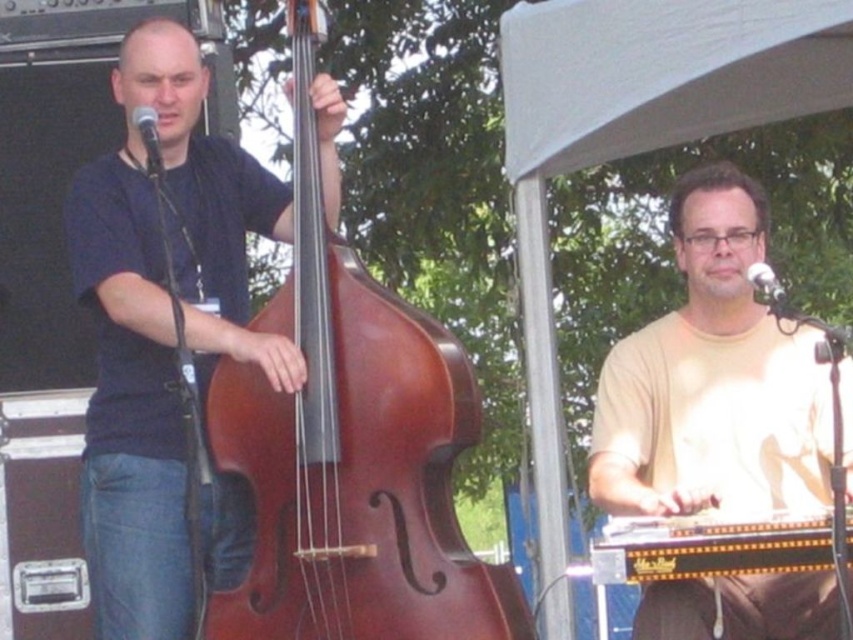
You are a stagehand setting up a new lighting rig that requires hanging a light 3 meters above the stage floor. The matte black microphone at upper left is currently positioned at 2.5 meters above the floor. Will the new light interfere with the microphone if placed directly above it?

The matte black microphone at upper left is currently positioned at 2.5 meters above the floor. The new light will be placed 3 meters above the floor, which is 0.5 meters higher. Since the light is only 0.5 meters above the microphone, there might be a risk of interference depending on the light fixture size and the microphone stand structure. However, based on the given height difference alone, the vertical distance is sufficient, but physical clearance must also be considered.